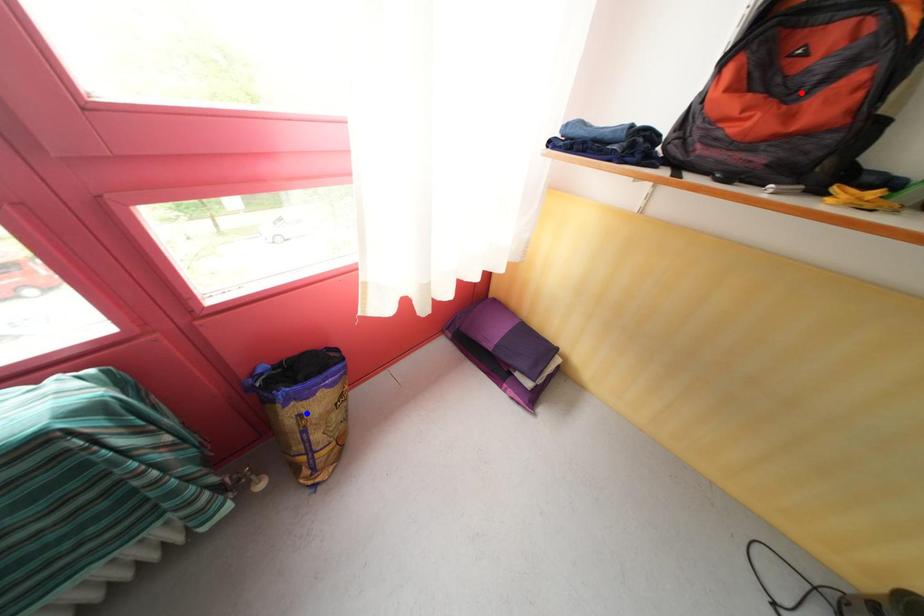
Question: Which of the two points in the image is closer to the camera?

Choices:
 (A) Blue point is closer.
 (B) Red point is closer.

Answer: (B)